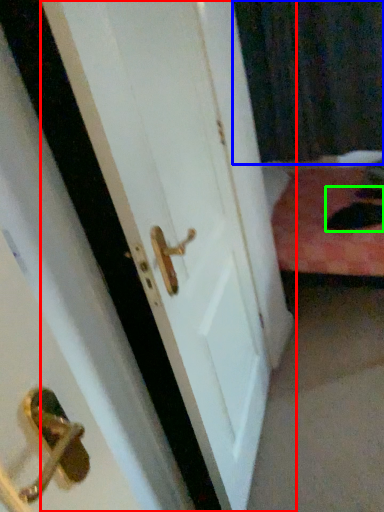
Question: Which object is the farthest from door (highlighted by a red box)? Choose among these: curtain (highlighted by a blue box) or cat (highlighted by a green box).

Choices:
 (A) curtain
 (B) cat

Answer: (A)